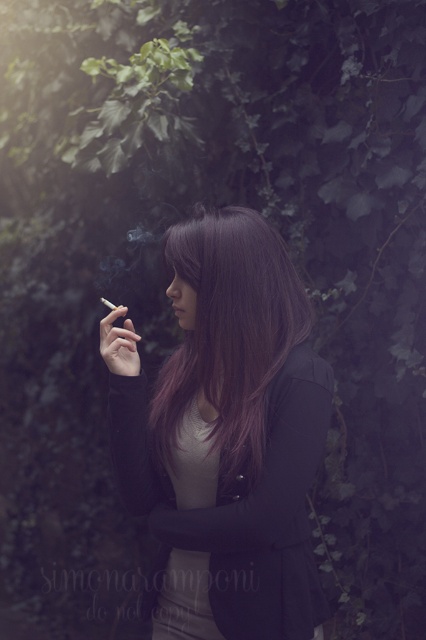
You are a photographer analyzing the lighting in the scene. You notice two distinct hair colors on the person at the center of the image. Which hair color, smooth black hair at center or purple shiny hair at center, is more prominent in the lighting due to its size?

The smooth black hair at center is bigger than the purple shiny hair at center, so the smooth black hair at center is more prominent in the lighting.

You are a photographer trying to focus on the person in the image. Which hair color is closer to your camera between the smooth black hair at center and the purple shiny hair at center?

The smooth black hair at center is closer to the viewer than the purple shiny hair at center, so the photographer should focus on the smooth black hair at center for better clarity.

You are a photographer trying to capture the person in the scene. The smooth black hair at center and purple shiny hair at center are both visible. Which hair color has a wider spread in the image?

The smooth black hair at center has a wider spread than the purple shiny hair at center.